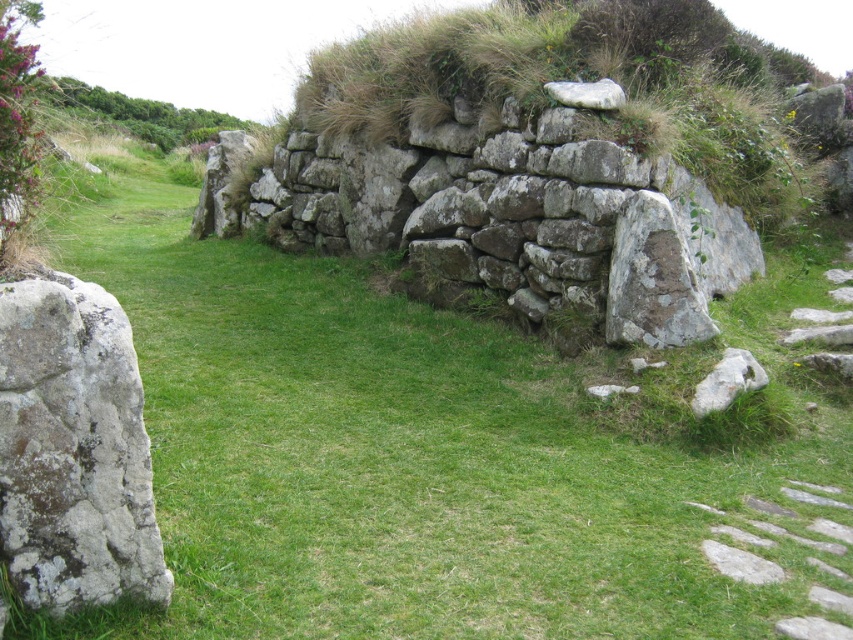
Question: Which point is farther to the camera?

Choices:
 (A) (7, 529)
 (B) (666, 202)
 (C) (732, 376)
 (D) (612, 108)

Answer: (D)

Question: Does rusty metallic rock at lower right appear on the left side of white smooth rock at upper center?

Choices:
 (A) no
 (B) yes

Answer: (A)

Question: Does natural stone wall at center appear over speckled gray rock at left?

Choices:
 (A) yes
 (B) no

Answer: (A)

Question: Among these points, which one is farthest from the camera?

Choices:
 (A) (590, 99)
 (B) (30, 440)
 (C) (474, 221)

Answer: (C)

Question: Can you confirm if rusty metallic rock at lower right is bigger than white smooth rock at upper center?

Choices:
 (A) yes
 (B) no

Answer: (A)

Question: Estimate the real-world distances between objects in this image. Which object is farther from the speckled gray rock at left?

Choices:
 (A) rusty metallic rock at lower right
 (B) white smooth rock at upper center
 (C) natural stone wall at center

Answer: (B)